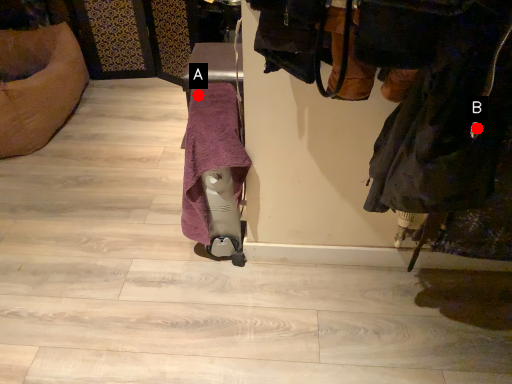
Question: Two points are circled on the image, labeled by A and B beside each circle. Which point is farther to the camera?

Choices:
 (A) A is further
 (B) B is further

Answer: (A)